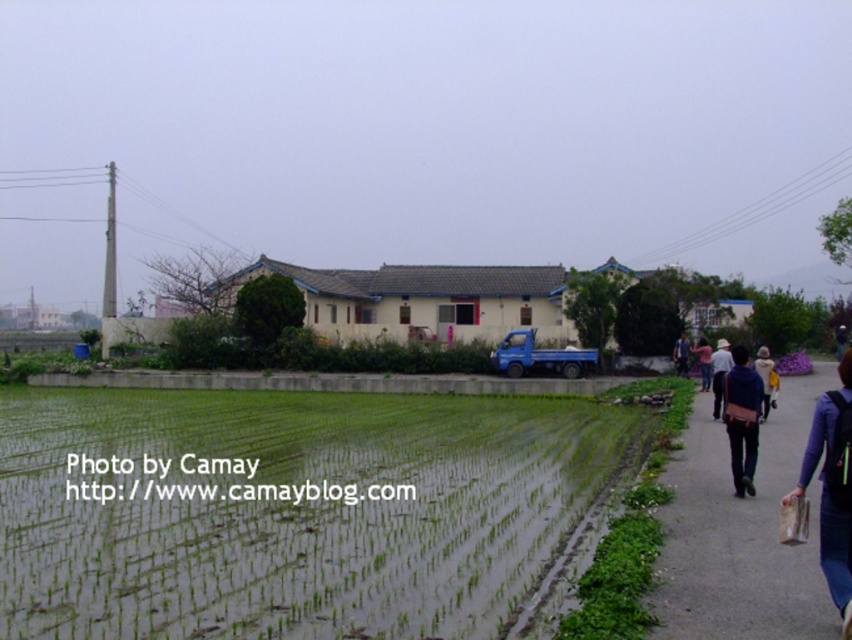
Question: From the image, what is the correct spatial relationship of gray asphalt pavement at lower right in relation to blue fabric jacket at right?

Choices:
 (A) left
 (B) right

Answer: (A)

Question: Can you confirm if green grassy rice field at lower left is smaller than gray asphalt pavement at lower right?

Choices:
 (A) yes
 (B) no

Answer: (A)

Question: Among these objects, which one is nearest to the camera?

Choices:
 (A) light blue shirt at center-right
 (B) pink fabric at right
 (C) dark blue jacket at right
 (D) light beige jacket at lower right

Answer: (D)

Question: Can you confirm if gray asphalt pavement at lower right is bigger than dark blue jacket at right?

Choices:
 (A) no
 (B) yes

Answer: (B)

Question: Which of the following is the farthest from the observer?

Choices:
 (A) gray asphalt pavement at lower right
 (B) light blue shirt at center-right

Answer: (B)

Question: Which point appears farthest from the camera in this image?

Choices:
 (A) (703, 353)
 (B) (781, 452)
 (C) (833, 401)
 (D) (735, 490)

Answer: (A)